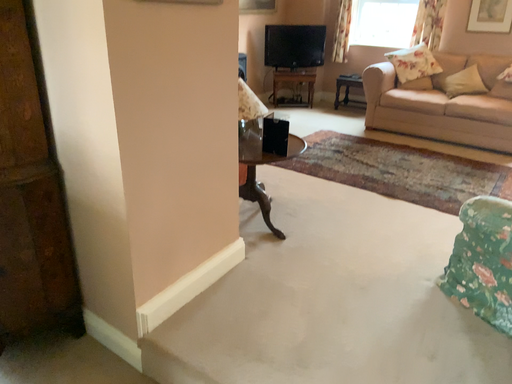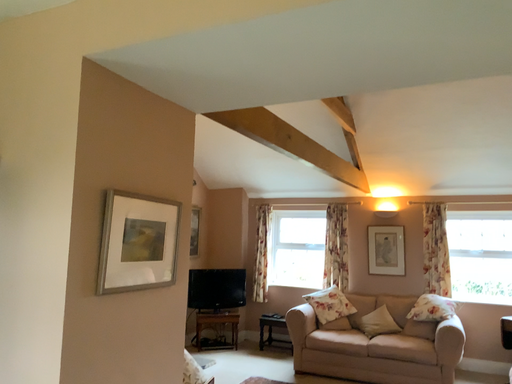
Question: How did the camera likely rotate when shooting the video?

Choices:
 (A) rotated downward
 (B) rotated upward

Answer: (B)